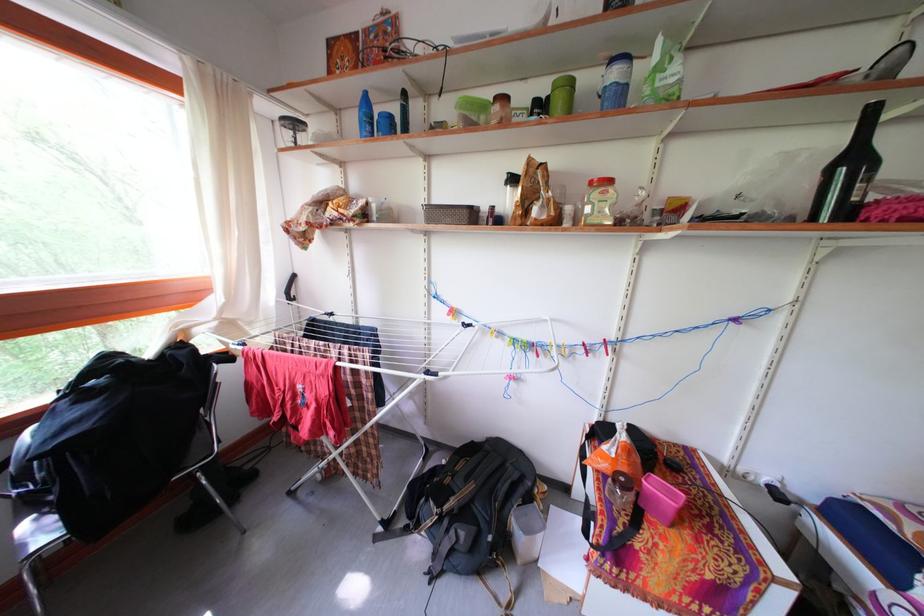
Image resolution: width=924 pixels, height=616 pixels. Describe the element at coordinates (289, 286) in the screenshot. I see `a black plastic handle` at that location.